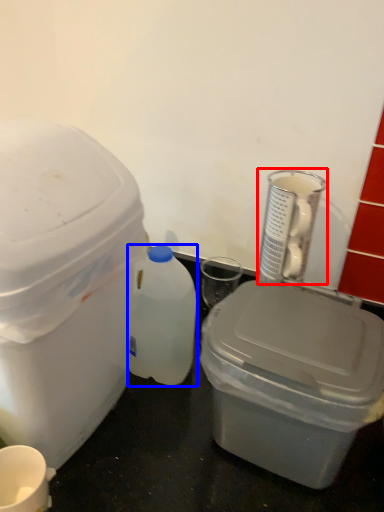
Question: Which of the following is the closest to the observer, appliance (highlighted by a red box) or bottle (highlighted by a blue box)?

Choices:
 (A) appliance
 (B) bottle

Answer: (B)